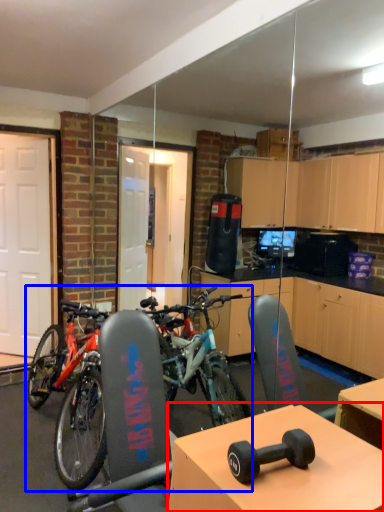
Question: Which object is further to the camera taking this photo, table (highlighted by a red box) or bicycle (highlighted by a blue box)?

Choices:
 (A) table
 (B) bicycle

Answer: (B)